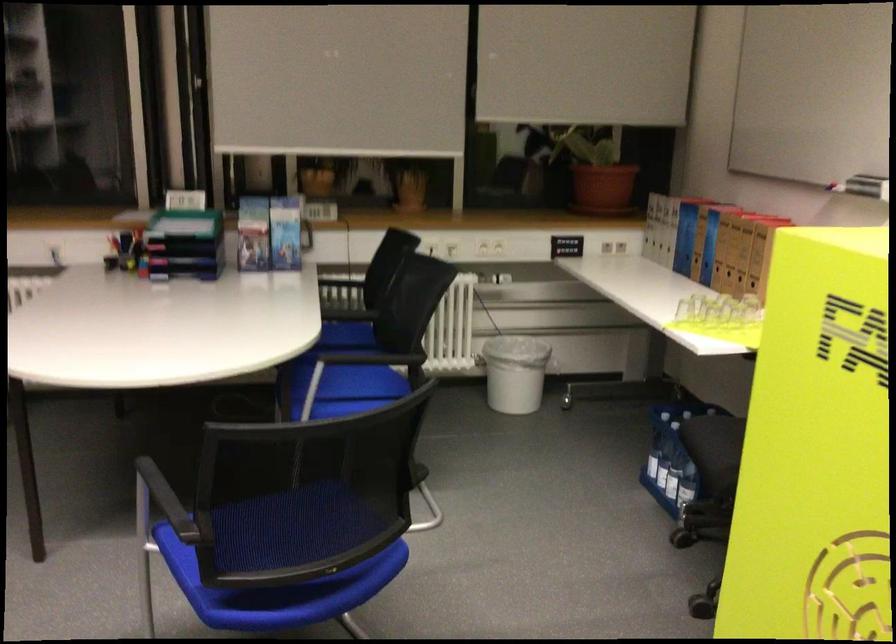
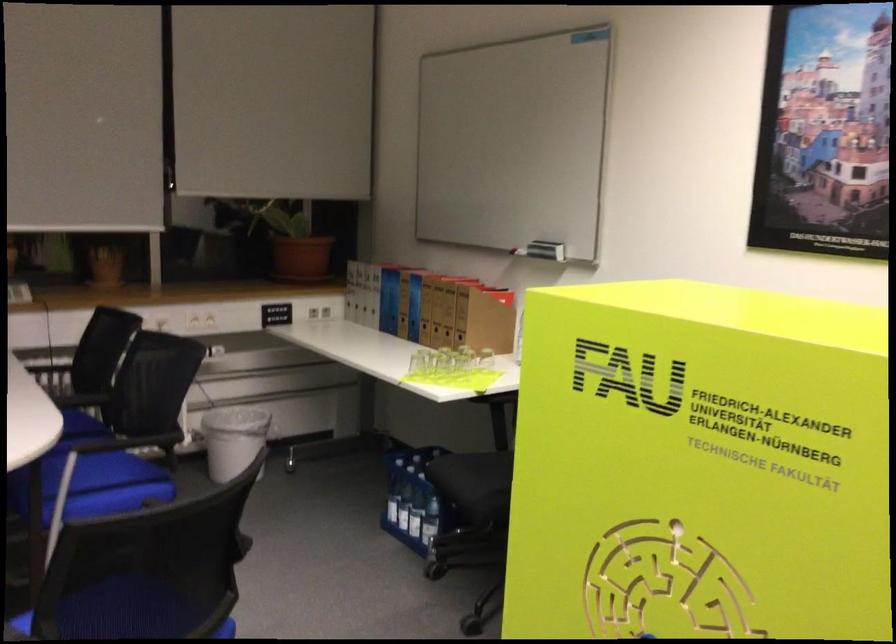
Where in the second image is the point corresponding to the point at 364,334 from the first image?

(81, 424)